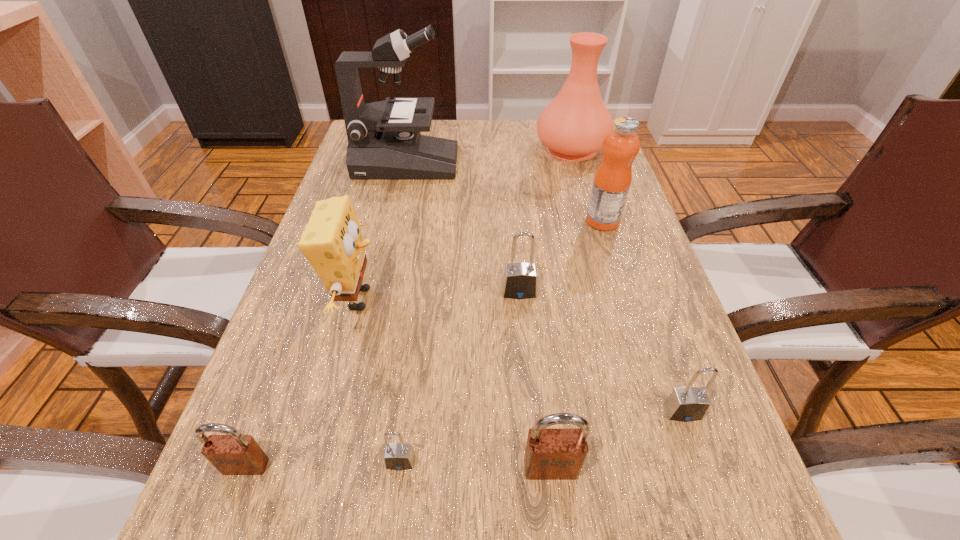
Locate an element on the screen. The width and height of the screenshot is (960, 540). object at the far left corner is located at coordinates (384, 141).

Where is `object that is at the far right corner`? object that is at the far right corner is located at coordinates (573, 126).

Locate an element on the screen. This screenshot has width=960, height=540. free region at the far edge of the desktop is located at coordinates pyautogui.click(x=517, y=150).

The image size is (960, 540). I want to click on vacant space at the left edge, so click(273, 404).

Identify the location of vacant area at the right edge. (638, 446).

Where is `free area in between the vase and the fruit juice`? free area in between the vase and the fruit juice is located at coordinates (588, 185).

Locate an element on the screen. Image resolution: width=960 pixels, height=540 pixels. empty location between the fruit juice and the microscope is located at coordinates (505, 192).

The width and height of the screenshot is (960, 540). Identify the location of vacant space that's between the microscope and the third farthest object. (505, 192).

In order to click on unoccupied position between the right brown padlock and the third tallest object in this screenshot , I will do `click(577, 345)`.

This screenshot has height=540, width=960. I want to click on unoccupied position between the shortest padlock and the microscope, so click(403, 313).